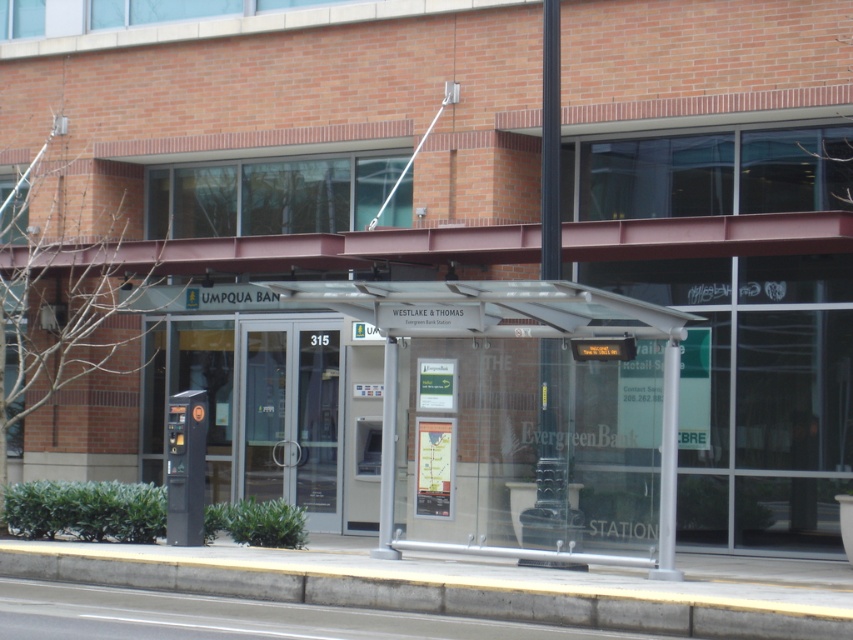
Between transparent glass bus stop at center and clear glass doors at center, which one appears on the left side from the viewer's perspective?

clear glass doors at center is more to the left.

Does transparent glass bus stop at center have a greater width compared to clear glass doors at center?

Indeed, transparent glass bus stop at center has a greater width compared to clear glass doors at center.

Is point (622, 330) closer to viewer compared to point (277, 435)?

Yes, it is.

The width and height of the screenshot is (853, 640). I want to click on transparent glass bus stop at center, so click(x=508, y=337).

Who is more distant from viewer, (323, 401) or (178, 442)?

Positioned behind is point (323, 401).

Which is in front, point (335, 509) or point (202, 449)?

Point (202, 449) is more forward.

This screenshot has width=853, height=640. I want to click on clear glass doors at center, so [x=291, y=417].

This screenshot has width=853, height=640. Describe the element at coordinates (444, 588) in the screenshot. I see `gray concrete curb at lower center` at that location.

Between point (392, 605) and point (170, 420), which one is positioned behind?

Point (170, 420)

Where is `gray concrete curb at lower center`? This screenshot has width=853, height=640. gray concrete curb at lower center is located at coordinates (444, 588).

This screenshot has width=853, height=640. I want to click on gray concrete curb at lower center, so click(x=444, y=588).